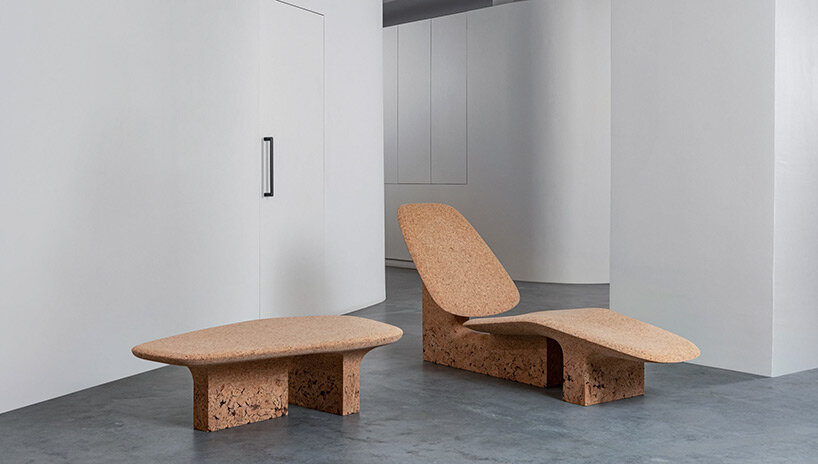
This screenshot has height=464, width=818. Find the location of `backrest`. backrest is located at coordinates (457, 258).